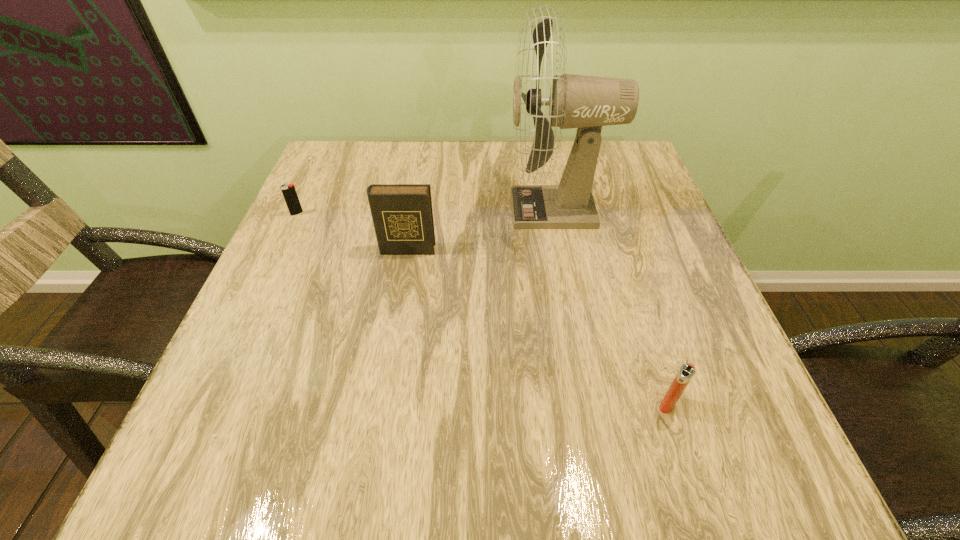
Identify the location of fan. (576, 101).

The width and height of the screenshot is (960, 540). Find the location of `the third object from right to left`. the third object from right to left is located at coordinates (402, 214).

Where is `diary`? diary is located at coordinates (402, 214).

Where is `the right igniter`? the right igniter is located at coordinates tap(686, 372).

Identify the location of the taller igniter. (686, 372).

Locate an element on the screen. the shorter igniter is located at coordinates (290, 195).

Identify the location of the left igniter. (290, 195).

Find the location of a particular element. The width and height of the screenshot is (960, 540). vacant point located on the air flow direction of the tallest object is located at coordinates (452, 210).

Locate an element on the screen. vacant region located 0.210m on the air flow direction of the tallest object is located at coordinates pyautogui.click(x=418, y=210).

Locate an element on the screen. free space located on the air flow direction of the tallest object is located at coordinates (440, 210).